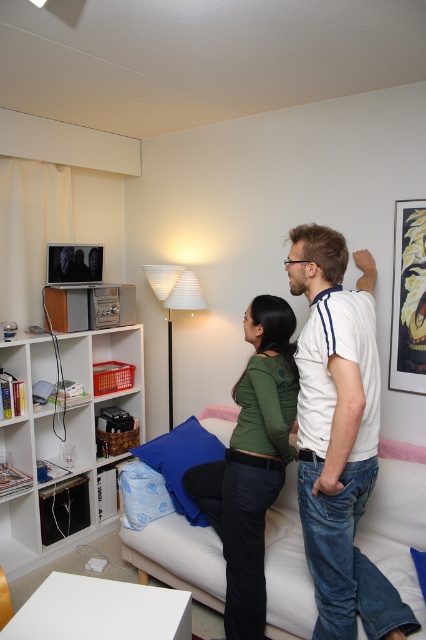
Looking at this image, you are standing in the living room and need to sit down on the soft fabric couch at center. Which side of the green matte shirt at center should you walk around to reach the couch?

You should walk around the right side of the green matte shirt at center to reach the soft fabric couch at center, since the couch is positioned to the right of the shirt.

You are a delivery person trying to place a large package on the couch. The package is as wide as the green matte shirt at center. Will the package fit on the soft fabric couch at center?

The soft fabric couch at center is wider than the green matte shirt at center, so the package, which is as wide as the green matte shirt at center, will fit on the soft fabric couch at center.